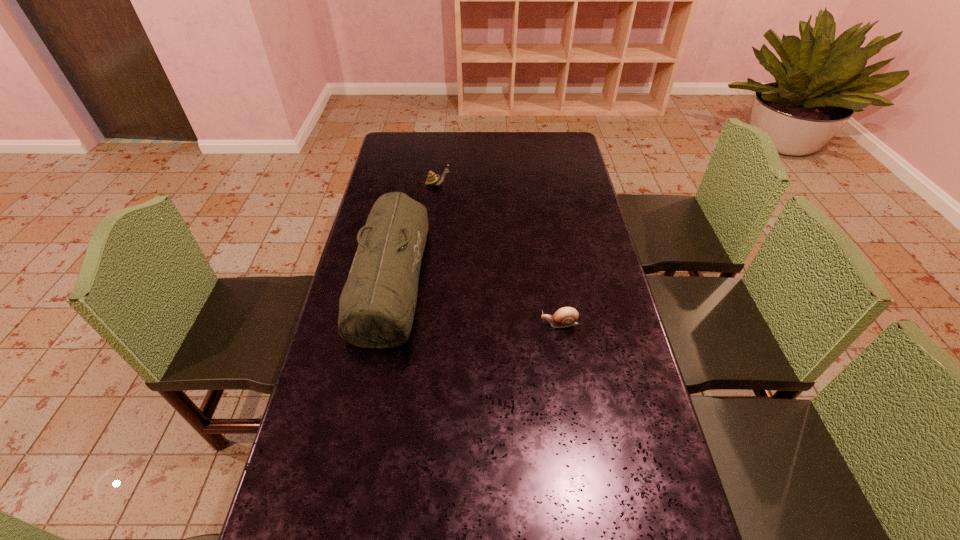
This screenshot has width=960, height=540. What are the coordinates of `free point between the nearer escargot and the farthest object` in the screenshot? It's located at (498, 254).

The width and height of the screenshot is (960, 540). I want to click on object that is the second closest to the taller escargot, so click(567, 316).

This screenshot has width=960, height=540. I want to click on object that is the closest to the rightmost object, so click(377, 305).